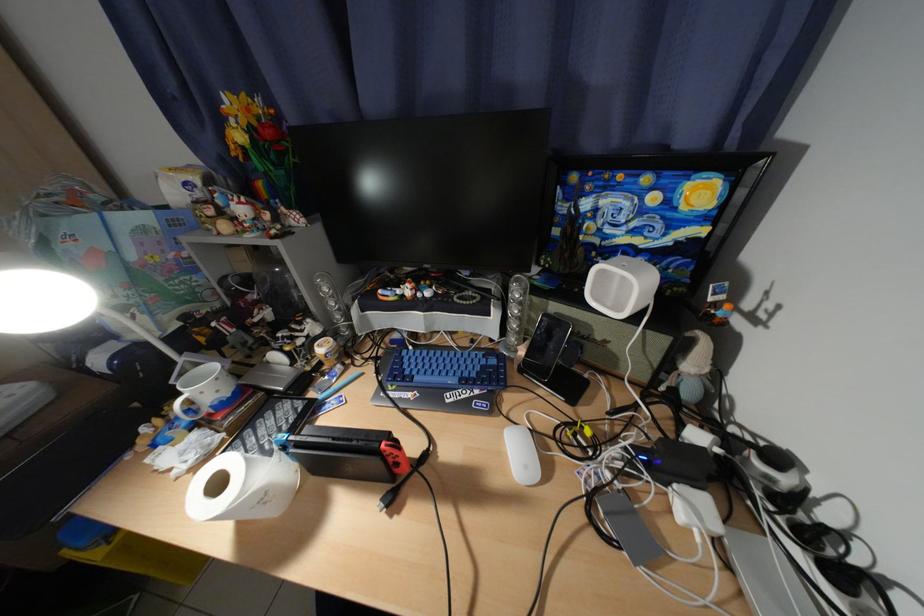
Find where to lift the white mug handle. Please return your answer as a coordinate pair (x, y).

(187, 408)